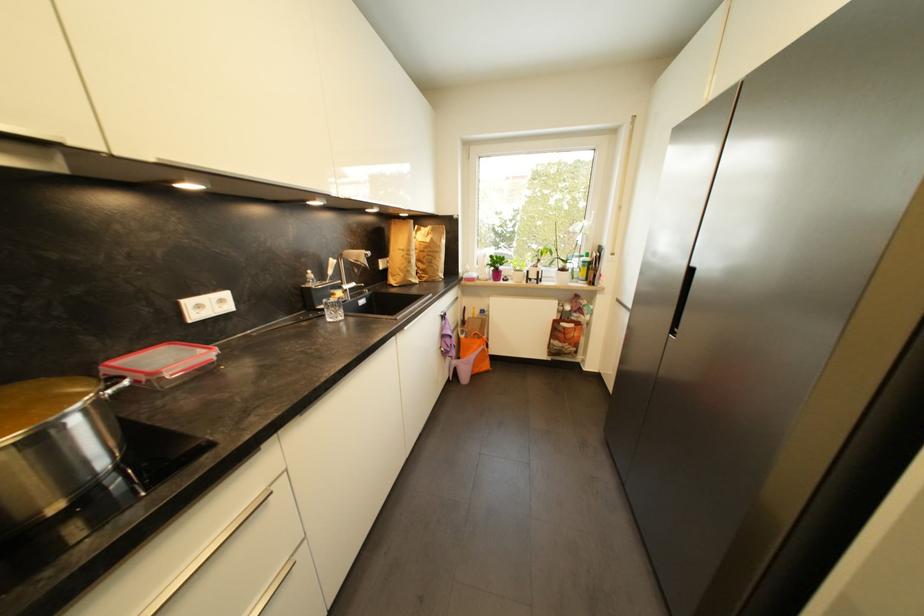
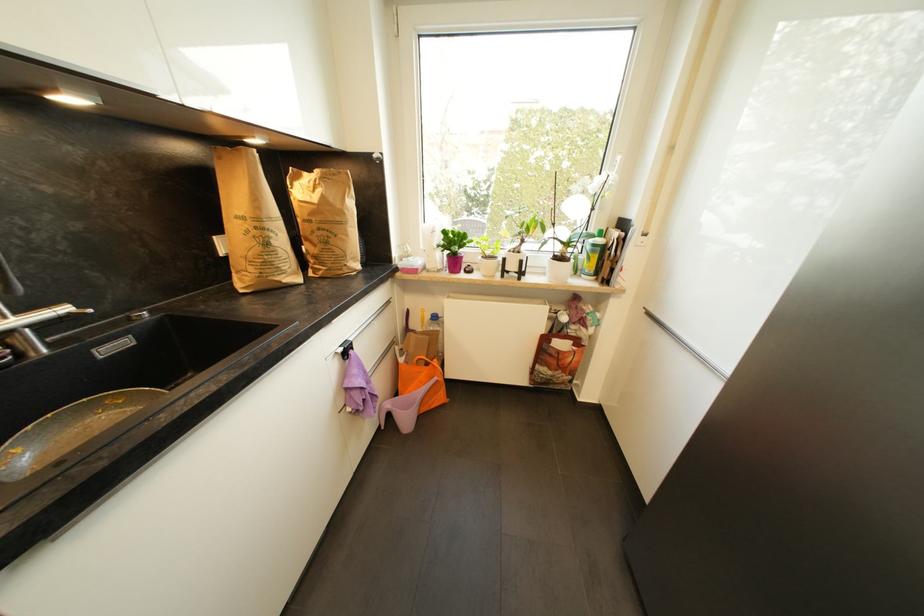
Question: Which direction would the cameraman need to move to produce the second image? Reply with the corresponding letter.

Choices:
 (A) Left
 (B) Right
 (C) Forward
 (D) Backward

Answer: (C)